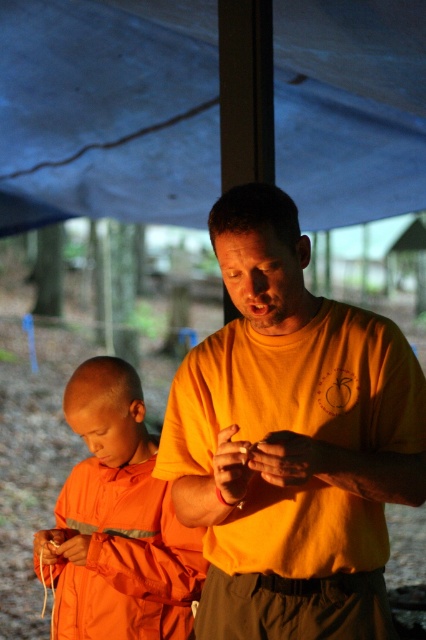
Question: Which of the following is the closest to the observer?

Choices:
 (A) (98, 477)
 (B) (307, 316)

Answer: (B)

Question: Estimate the real-world distances between objects in this image. Which object is closer to the matte orange shirt at center?

Choices:
 (A) orange matte/soft fabric at left
 (B) orange matte shirt at center

Answer: (B)

Question: Which object appears farthest from the camera in this image?

Choices:
 (A) smooth orange monk at center
 (B) orange matte/soft fabric at left
 (C) orange matte shirt at center
 (D) matte orange shirt at center

Answer: (A)

Question: Does orange matte/soft fabric at left have a larger size compared to matte orange shirt at center?

Choices:
 (A) no
 (B) yes

Answer: (B)

Question: Is matte orange shirt at center further to camera compared to smooth orange monk at center?

Choices:
 (A) no
 (B) yes

Answer: (A)

Question: Is orange matte shirt at center thinner than smooth orange monk at center?

Choices:
 (A) no
 (B) yes

Answer: (A)